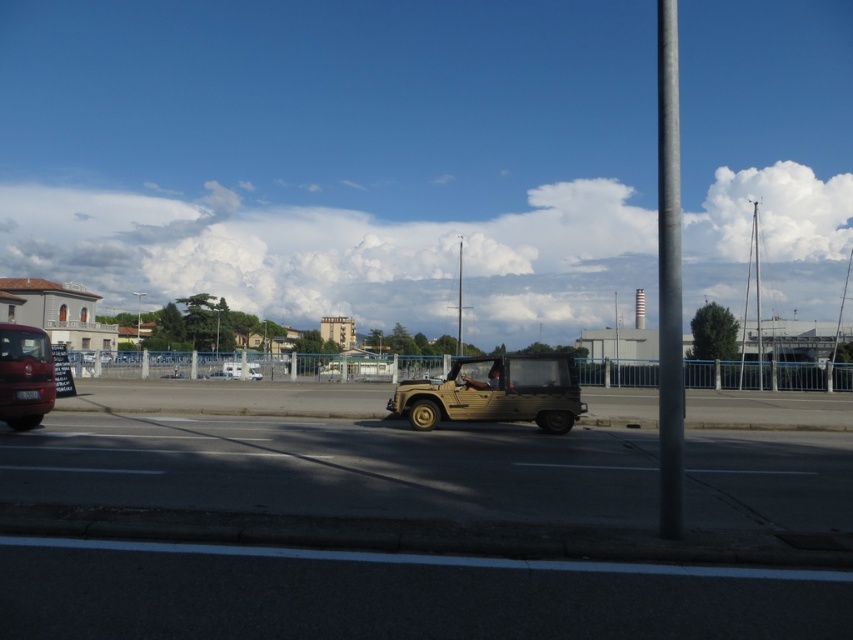
You are a delivery person who needs to place a package on the smooth gray pole at right. However, there is a shiny red bus at left blocking your path. Can you reach the pole without moving the bus?

The smooth gray pole at right is above the shiny red bus at left, so you can reach the pole without moving the bus since it is positioned higher than the bus.

You are a pedestrian standing on the sidewalk near the road. You see the smooth gray pole at right and the shiny red bus at left. Which object is nearer to you?

The smooth gray pole at right is closer to the viewer than the shiny red bus at left.

You are a delivery person needing to load a tall package onto a vehicle. Based on the scene, which vehicle between the matte khaki jeep at center and the shiny red bus at left can accommodate the package without exceeding height restrictions?

The shiny red bus at left is taller than the matte khaki jeep at center, so the shiny red bus at left can accommodate the tall package without exceeding height restrictions.